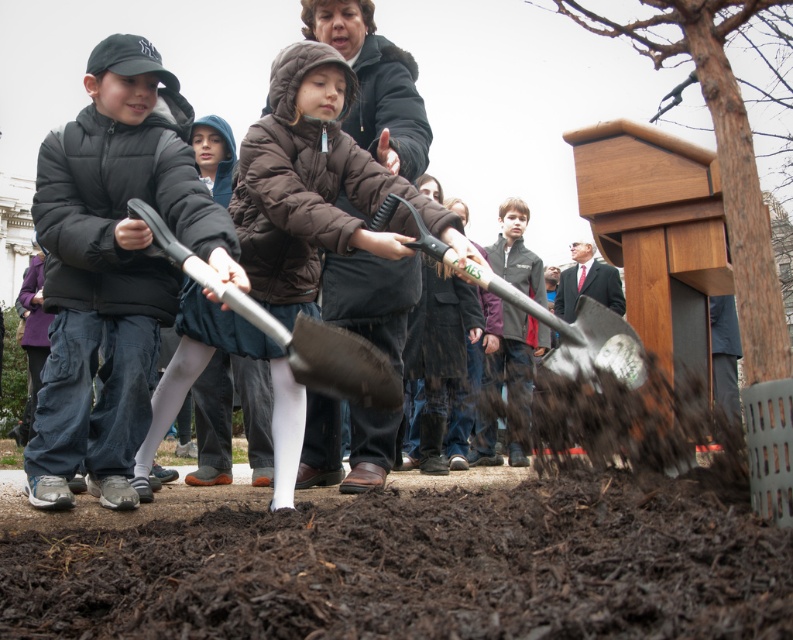
Who is positioned more to the right, matte black jacket at left or silver metallic shovel at center?

Positioned to the right is silver metallic shovel at center.

Who is higher up, matte black jacket at left or silver metallic shovel at center?

Positioned higher is matte black jacket at left.

The width and height of the screenshot is (793, 640). In order to click on matte black jacket at left in this screenshot , I will do `click(112, 268)`.

Describe the element at coordinates (292, 332) in the screenshot. This screenshot has height=640, width=793. I see `silver metallic shovel at center` at that location.

The height and width of the screenshot is (640, 793). In order to click on silver metallic shovel at center in this screenshot , I will do `click(292, 332)`.

Between point (60, 323) and point (577, 336), which one is positioned in front?

Point (577, 336) is in front.

Locate an element on the screen. This screenshot has height=640, width=793. matte black jacket at left is located at coordinates (112, 268).

The image size is (793, 640). Find the location of `matte black jacket at left`. matte black jacket at left is located at coordinates (112, 268).